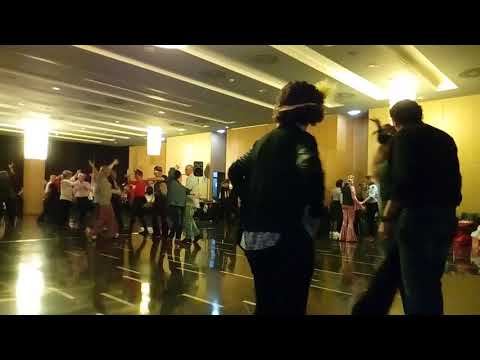
The image size is (480, 360). I want to click on circles in the celing, so click(x=468, y=73), click(x=266, y=60), click(x=212, y=74), click(x=89, y=108), click(x=115, y=101), click(x=175, y=125), click(x=202, y=120).